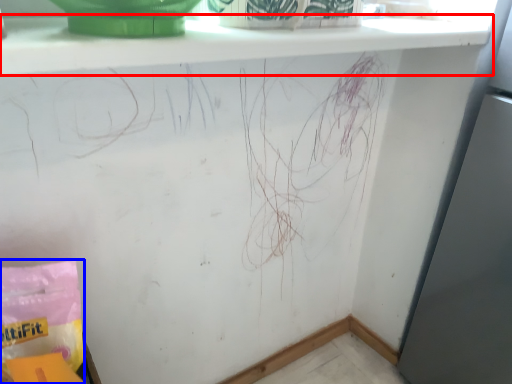
Question: Which point is further to the camera, window sill (highlighted by a red box) or material (highlighted by a blue box)?

Choices:
 (A) window sill
 (B) material

Answer: (B)